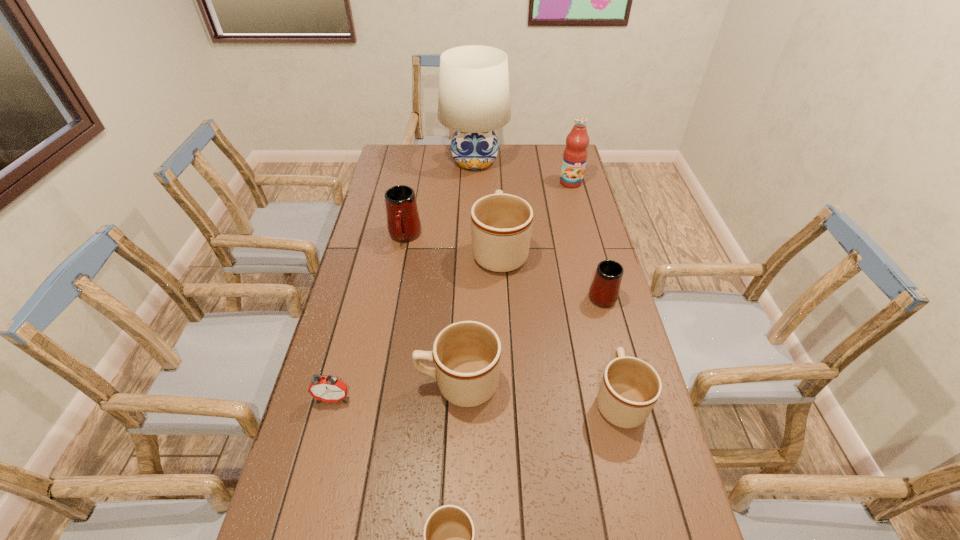
At what (x,y) coordinates should I click in order to perform the action: click on fruit juice located at the right edge. Please return your answer as a coordinate pair (x, y). Looking at the image, I should click on (575, 153).

This screenshot has height=540, width=960. In the image, there is a desktop. Identify the location of vacant space at the far edge. (424, 145).

The image size is (960, 540). In order to click on free space at the left edge of the desktop in this screenshot , I will do `click(358, 441)`.

This screenshot has width=960, height=540. In the image, there is a desktop. Identify the location of vacant space at the right edge. (578, 275).

Locate an element on the screen. The image size is (960, 540). vacant area at the far left corner is located at coordinates (389, 153).

Identify the location of blank region between the alarm clock and the third smallest brown mug. (396, 391).

What are the coordinates of `free space between the alarm clock and the second biggest brown mug` in the screenshot? It's located at (396, 391).

Where is `vacant space that is in between the biggest brown mug and the second tallest object`? vacant space that is in between the biggest brown mug and the second tallest object is located at coordinates (536, 217).

At what (x,y) coordinates should I click in order to perform the action: click on vacant area between the tallest object and the left red mug. Please return your answer as a coordinate pair (x, y). This screenshot has width=960, height=540. Looking at the image, I should click on (x=440, y=199).

Where is `free spot between the third biggest brown mug and the third smallest brown mug`? free spot between the third biggest brown mug and the third smallest brown mug is located at coordinates (539, 392).